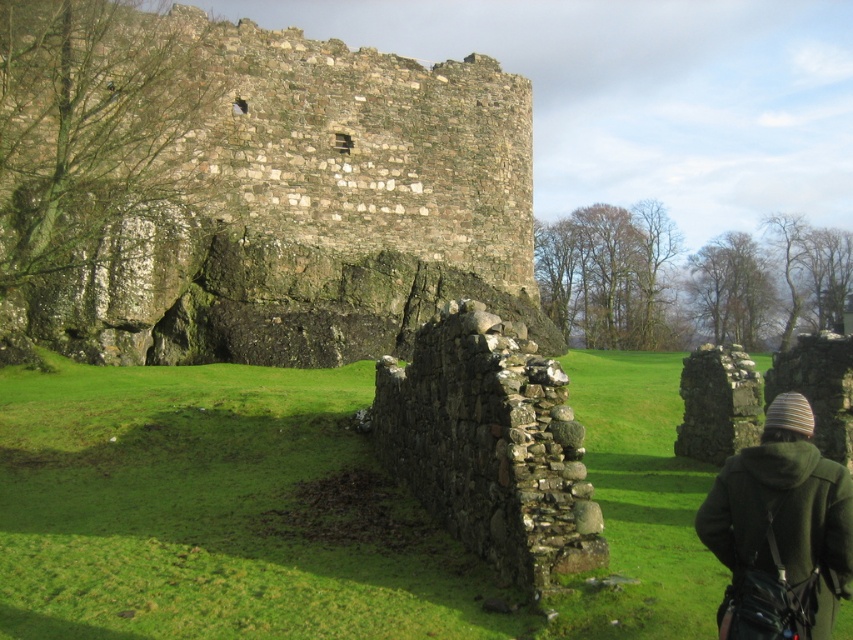
Does rustic stone wall at upper left have a larger size compared to striped woolen hat at lower right?

Yes, rustic stone wall at upper left is bigger than striped woolen hat at lower right.

Is rustic stone wall at upper left smaller than striped woolen hat at lower right?

No, rustic stone wall at upper left is not smaller than striped woolen hat at lower right.

Measure the distance between rustic stone wall at upper left and camera.

A distance of 42.68 meters exists between rustic stone wall at upper left and camera.

This screenshot has width=853, height=640. Identify the location of rustic stone wall at upper left. (248, 192).